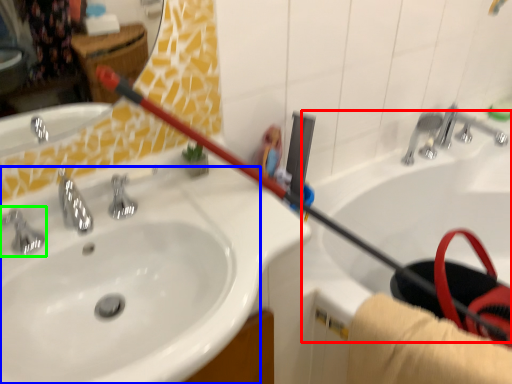
Question: Which object is positioned closest to bath (highlighted by a red box)? Select from sink (highlighted by a blue box) and tap (highlighted by a green box).

Choices:
 (A) sink
 (B) tap

Answer: (A)